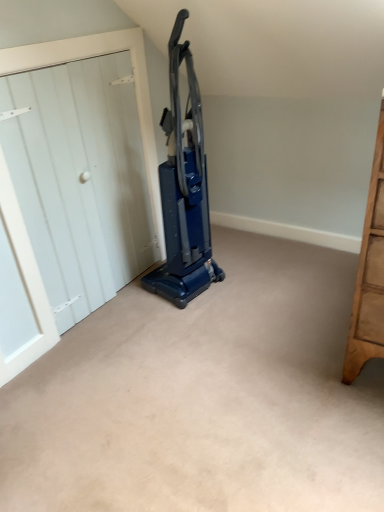
Where is `free space that is in between white wood door at left and blue plastic vacuum cleaner at center`? The image size is (384, 512). free space that is in between white wood door at left and blue plastic vacuum cleaner at center is located at coordinates (134, 313).